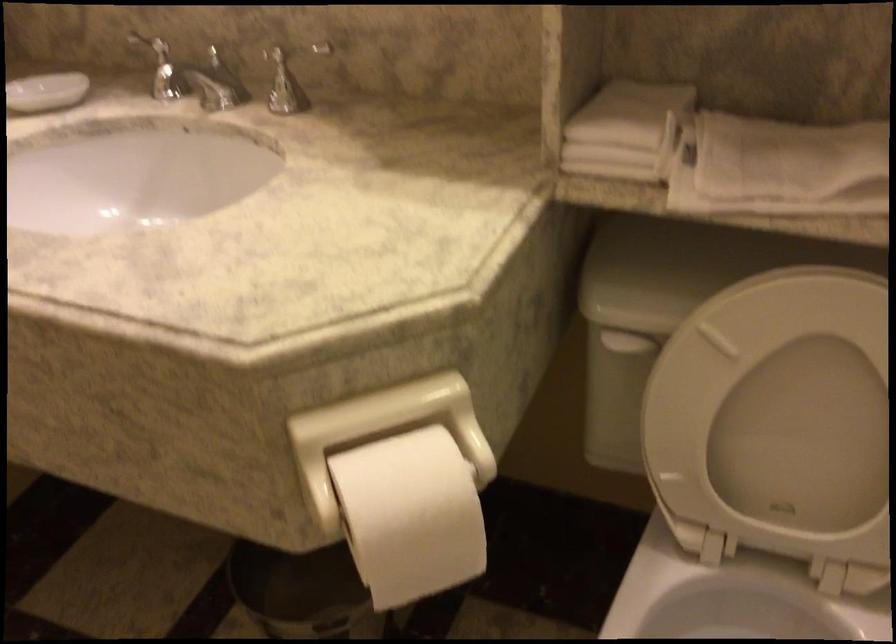
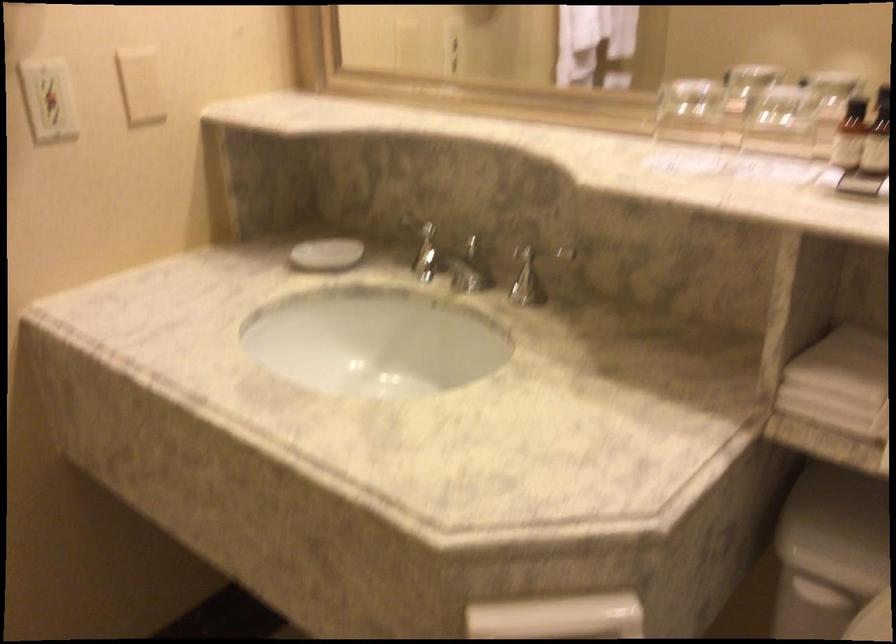
Locate, in the second image, the point that corresponds to point (615, 131) in the first image.

(840, 383)